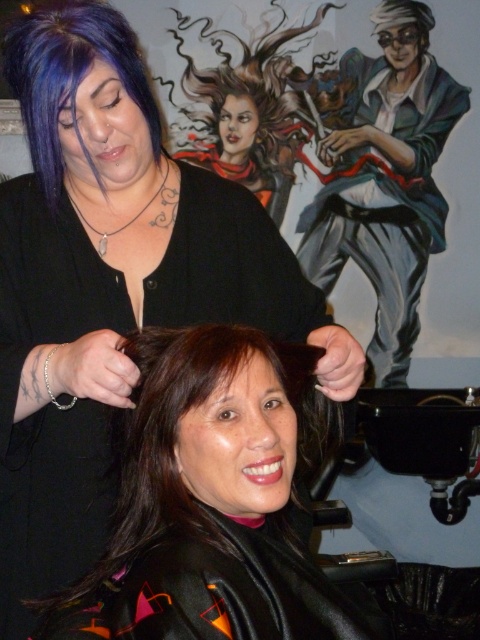
Can you confirm if brown smooth hair at center is shorter than shiny blue jacket at upper right?

Yes.

Is point (131, 529) more distant than point (423, 60)?

No, it is in front of (423, 60).

Which is in front, point (233, 483) or point (312, 202)?

Point (233, 483) is in front.

What are the coordinates of `brown smooth hair at center` in the screenshot? It's located at (208, 442).

Can you confirm if shiny blue jacket at upper right is wider than purple matte hair at upper left?

Indeed, shiny blue jacket at upper right has a greater width compared to purple matte hair at upper left.

Does shiny blue jacket at upper right have a smaller size compared to purple matte hair at upper left?

No.

Does point (432, 109) come behind point (44, 40)?

Yes, it is behind point (44, 40).

The image size is (480, 640). Identify the location of shiny blue jacket at upper right. (384, 177).

Does brown smooth hair at center appear under purple matte hair at upper left?

Indeed, brown smooth hair at center is positioned under purple matte hair at upper left.

Which is above, brown smooth hair at center or purple matte hair at upper left?

purple matte hair at upper left is above.

You are a GUI agent. You are given a task and a screenshot of the screen. Output one action in this format:
    pyautogui.click(x=<x>, y=<y>)
    Task: Click on the brown smooth hair at center
    
    Given the screenshot: What is the action you would take?
    pyautogui.click(x=208, y=442)